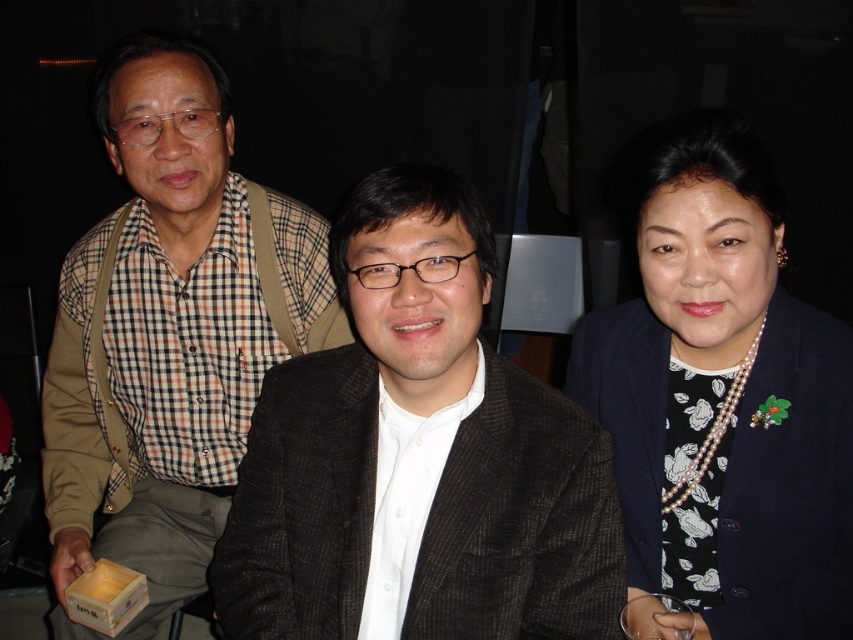
From the picture: You are a photographer trying to adjust the lighting for a group photo. You notice two blazers at the center of the image. Which blazer is positioned lower on the person? The dark brown textured blazer at center or the navy blue blazer at center?

The dark brown textured blazer at center is positioned lower because it is below the navy blue blazer at center.

In the image of three people at an event, the brown checkered shirt at left and pearl necklace at right are visible. Which object is positioned farther to the left?

The brown checkered shirt at left is positioned farther to the left than the pearl necklace at right.